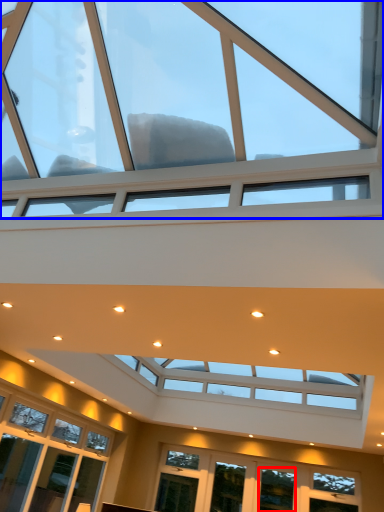
Question: Among these objects, which one is nearest to the camera, window (highlighted by a red box) or window (highlighted by a blue box)?

Choices:
 (A) window
 (B) window

Answer: (B)